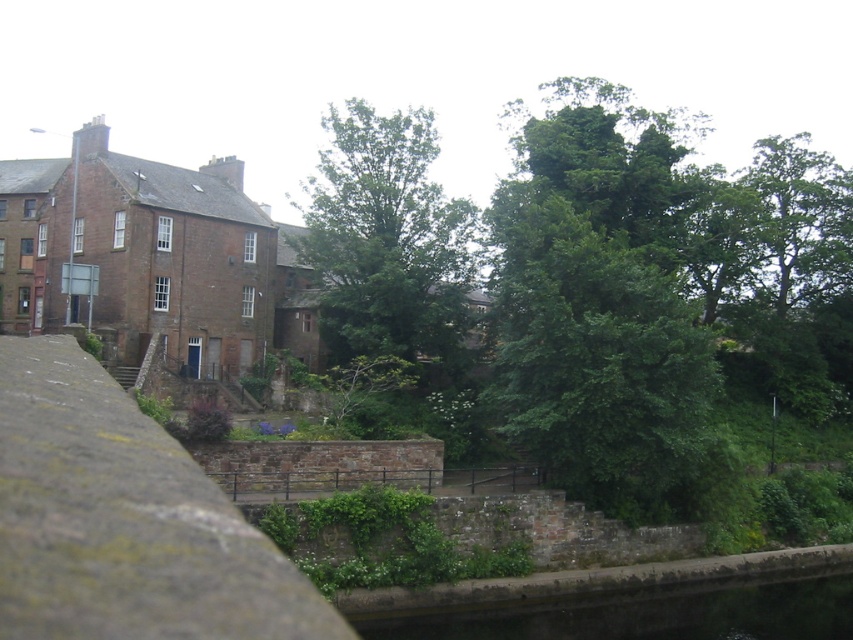
Who is positioned more to the left, green leafy tree at center or green concrete waterway at lower center?

From the viewer's perspective, green leafy tree at center appears more on the left side.

Does green leafy tree at center appear over green concrete waterway at lower center?

Yes, green leafy tree at center is above green concrete waterway at lower center.

Between point (421, 259) and point (804, 636), which one is positioned in front?

Point (804, 636) is in front.

You are a GUI agent. You are given a task and a screenshot of the screen. Output one action in this format:
    pyautogui.click(x=<x>, y=<y>)
    Task: Click on the green leafy tree at center
    
    Given the screenshot: What is the action you would take?
    pyautogui.click(x=387, y=240)